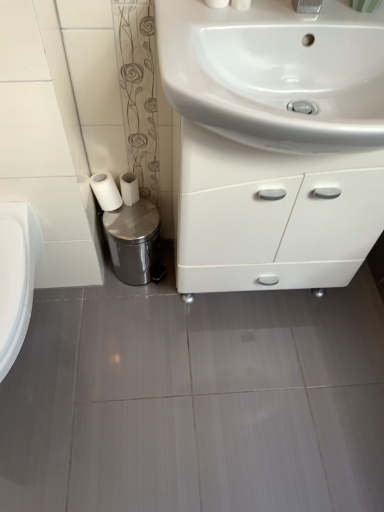
Question: From the image's perspective, is white matte toilet paper at lower left, the second toilet paper from the right, above white glossy sink at upper center?

Choices:
 (A) no
 (B) yes

Answer: (A)

Question: Is white matte toilet paper at lower left, the second toilet paper from the right, facing towards white glossy sink at upper center?

Choices:
 (A) no
 (B) yes

Answer: (A)

Question: Is white matte toilet paper at lower left, which ranks as the first toilet paper in left-to-right order, completely or partially outside of white glossy sink at upper center?

Choices:
 (A) no
 (B) yes

Answer: (B)

Question: Does white matte toilet paper at lower left, which ranks as the first toilet paper in left-to-right order, appear on the right side of white glossy sink at upper center?

Choices:
 (A) yes
 (B) no

Answer: (B)

Question: Is white matte toilet paper at lower left, which ranks as the first toilet paper in left-to-right order, closer to camera compared to white glossy sink at upper center?

Choices:
 (A) yes
 (B) no

Answer: (B)

Question: Is white glossy cabinet at center inside the boundaries of white matte toilet paper at lower left, the second toilet paper in the left-to-right sequence, or outside?

Choices:
 (A) inside
 (B) outside

Answer: (B)

Question: Considering the positions of white glossy cabinet at center and white matte toilet paper at lower left, positioned as the first toilet paper in right-to-left order, in the image, is white glossy cabinet at center bigger or smaller than white matte toilet paper at lower left, positioned as the first toilet paper in right-to-left order,?

Choices:
 (A) small
 (B) big

Answer: (B)

Question: From the image's perspective, is white glossy cabinet at center above or below white matte toilet paper at lower left, the second toilet paper in the left-to-right sequence?

Choices:
 (A) below
 (B) above

Answer: (A)

Question: Based on their positions, is white glossy cabinet at center located to the left or right of white matte toilet paper at lower left, positioned as the first toilet paper in right-to-left order?

Choices:
 (A) left
 (B) right

Answer: (B)

Question: Based on their positions, is white matte toilet paper at lower left, the second toilet paper from the right, located to the left or right of shiny metallic trash can at lower left?

Choices:
 (A) right
 (B) left

Answer: (B)

Question: Relative to shiny metallic trash can at lower left, is white matte toilet paper at lower left, which ranks as the first toilet paper in left-to-right order, in front or behind?

Choices:
 (A) behind
 (B) front

Answer: (B)

Question: From the image's perspective, relative to shiny metallic trash can at lower left, is white matte toilet paper at lower left, the second toilet paper from the right, above or below?

Choices:
 (A) above
 (B) below

Answer: (A)

Question: Does point (117, 204) appear closer or farther from the camera than point (119, 218)?

Choices:
 (A) farther
 (B) closer

Answer: (B)

Question: From their relative heights in the image, would you say white matte toilet paper at lower left, which ranks as the first toilet paper in left-to-right order, is taller or shorter than white glossy cabinet at center?

Choices:
 (A) tall
 (B) short

Answer: (B)

Question: Would you say white matte toilet paper at lower left, which ranks as the first toilet paper in left-to-right order, is to the left or to the right of white glossy cabinet at center in the picture?

Choices:
 (A) left
 (B) right

Answer: (A)